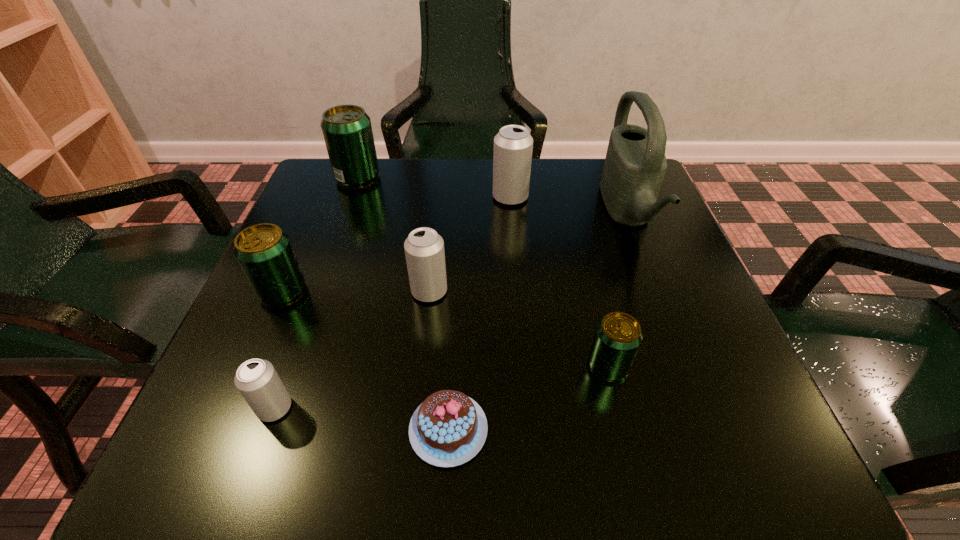
Locate an element on the screen. The image size is (960, 540). empty location between the second nearest beer can and the second nearest green beer can is located at coordinates (445, 329).

This screenshot has width=960, height=540. What are the coordinates of `vacant space in between the biggest green beer can and the rightmost green beer can` in the screenshot? It's located at (483, 272).

At what (x,y) coordinates should I click in order to perform the action: click on free space between the farthest white beer can and the third nearest object. Please return your answer as a coordinate pair (x, y). Looking at the image, I should click on (559, 281).

In order to click on vacant region between the nearest beer can and the tallest object in this screenshot , I will do `click(451, 310)`.

This screenshot has width=960, height=540. I want to click on vacant space in between the sixth object from left to right and the watering can, so click(x=568, y=205).

The width and height of the screenshot is (960, 540). I want to click on vacant area that lies between the watering can and the second farthest green beer can, so click(x=455, y=252).

At what (x,y) coordinates should I click in order to perform the action: click on vacant space that's between the rightmost beer can and the tallest object. Please return your answer as a coordinate pair (x, y). This screenshot has height=540, width=960. Looking at the image, I should click on (617, 289).

Where is `the fourth closest object to the second smallest white beer can`? the fourth closest object to the second smallest white beer can is located at coordinates (513, 145).

Identify the location of object that stands as the second closest to the tallest object. (618, 335).

Identify which beer can is located as the nearest to the second white beer can from left to right. Please provide its 2D coordinates. Your answer should be formatted as a tuple, i.e. [(x, y)], where the tuple contains the x and y coordinates of a point satisfying the conditions above.

[(264, 252)]